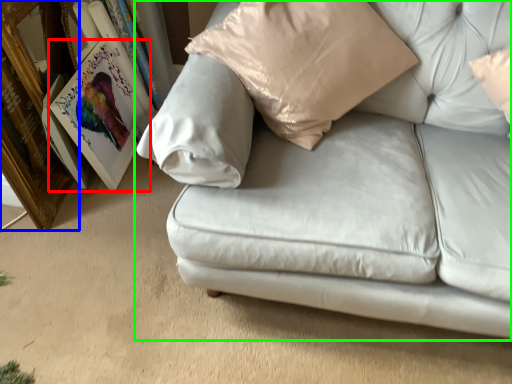
Question: Which object is the farthest from picture frame (highlighted by a red box)? Choose among these: picture frame (highlighted by a blue box) or studio couch (highlighted by a green box).

Choices:
 (A) picture frame
 (B) studio couch

Answer: (B)